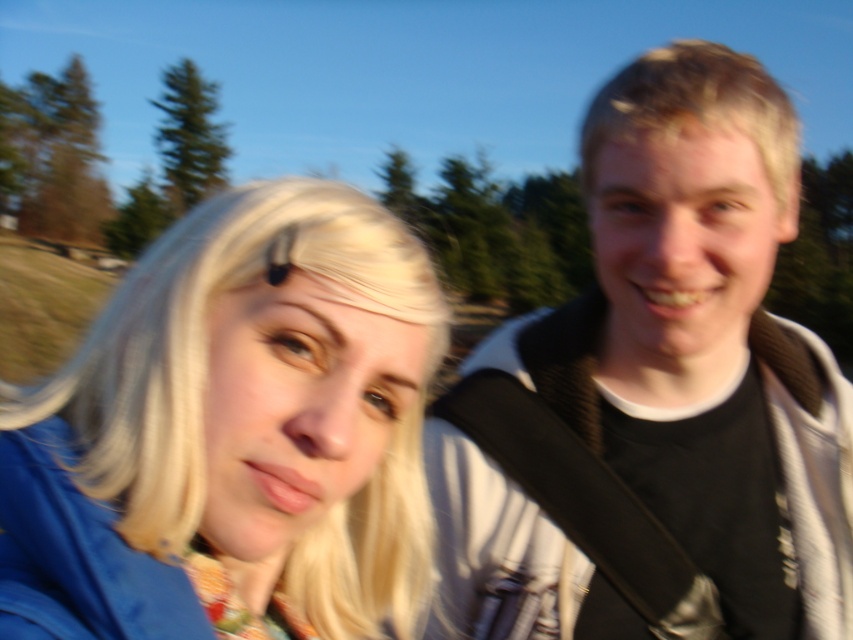
Question: In this image, where is black cotton shirt at right located relative to blonde hair at left?

Choices:
 (A) left
 (B) right

Answer: (B)

Question: Is black cotton shirt at right further to camera compared to blonde hair at left?

Choices:
 (A) yes
 (B) no

Answer: (A)

Question: Which point is closer to the camera?

Choices:
 (A) (x=274, y=412)
 (B) (x=730, y=202)

Answer: (A)

Question: Does black cotton shirt at right appear under blonde hair at left?

Choices:
 (A) yes
 (B) no

Answer: (B)